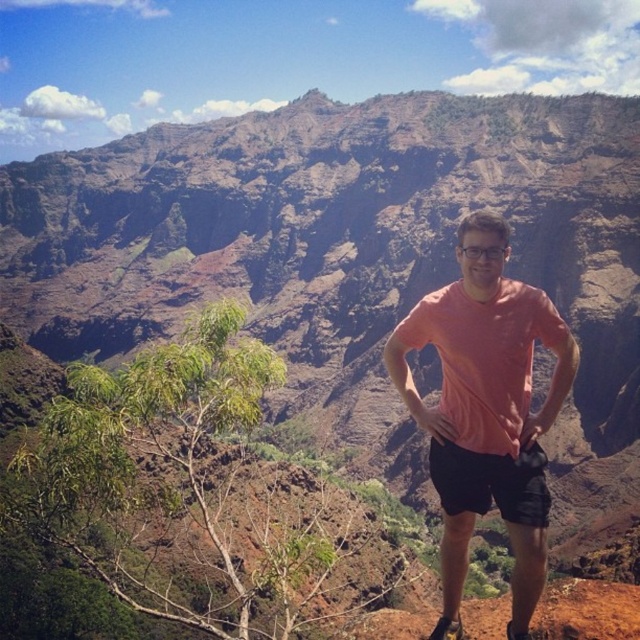
Does point (506, 406) lie in front of point (464, 476)?

No, (506, 406) is further to viewer.

From the picture: Can you confirm if pink cotton shirt at center is positioned below black cotton shorts at center?

No.

Is point (504, 461) more distant than point (452, 474)?

No, it is in front of (452, 474).

Identify the location of pink cotton shirt at center. coord(486,410).